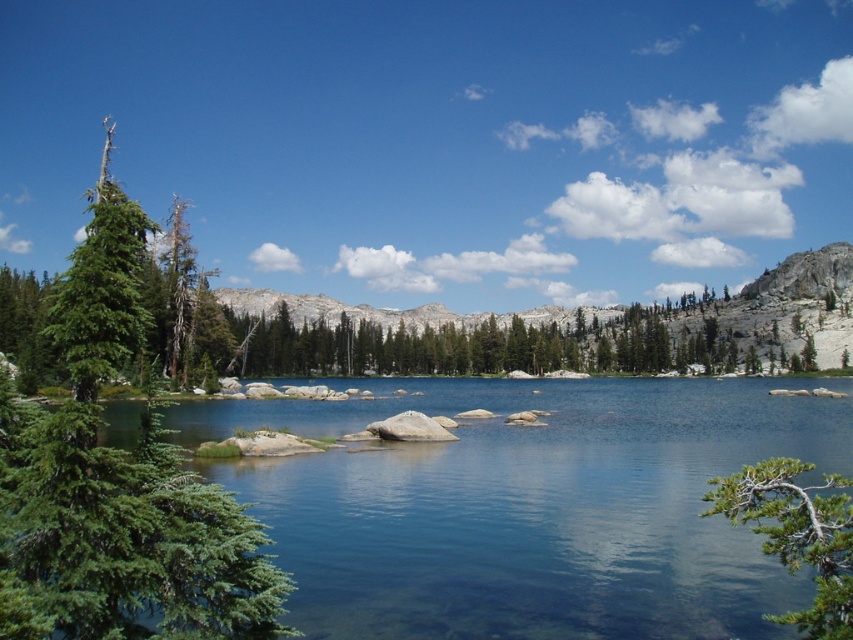
Can you confirm if clear water at center is wider than green needle-like tree at left?

Yes, clear water at center is wider than green needle-like tree at left.

Which of these two, clear water at center or green needle-like tree at left, stands taller?

green needle-like tree at left is taller.

Who is more distant from viewer, (x=410, y=525) or (x=91, y=449)?

The point (x=410, y=525) is behind.

Locate an element on the screen. clear water at center is located at coordinates (529, 506).

Between green needle-like tree at left and green textured branch at lower right, which one appears on the left side from the viewer's perspective?

Positioned to the left is green needle-like tree at left.

Identify the location of green needle-like tree at left. The height and width of the screenshot is (640, 853). (125, 477).

Can you confirm if clear water at center is positioned below green textured branch at lower right?

No, clear water at center is not below green textured branch at lower right.

Looking at this image, does clear water at center have a lesser height compared to green textured branch at lower right?

Yes, clear water at center is shorter than green textured branch at lower right.

Identify the location of clear water at center. (529, 506).